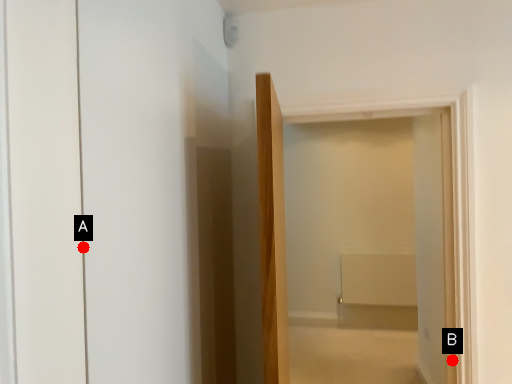
Question: Two points are circled on the image, labeled by A and B beside each circle. Among these points, which one is farthest from the camera?

Choices:
 (A) A is further
 (B) B is further

Answer: (B)